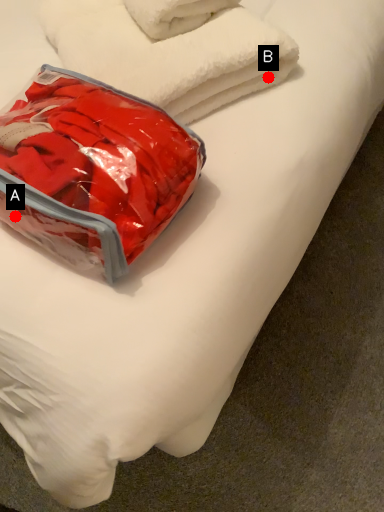
Question: Two points are circled on the image, labeled by A and B beside each circle. Which of the following is the closest to the observer?

Choices:
 (A) A is closer
 (B) B is closer

Answer: (A)